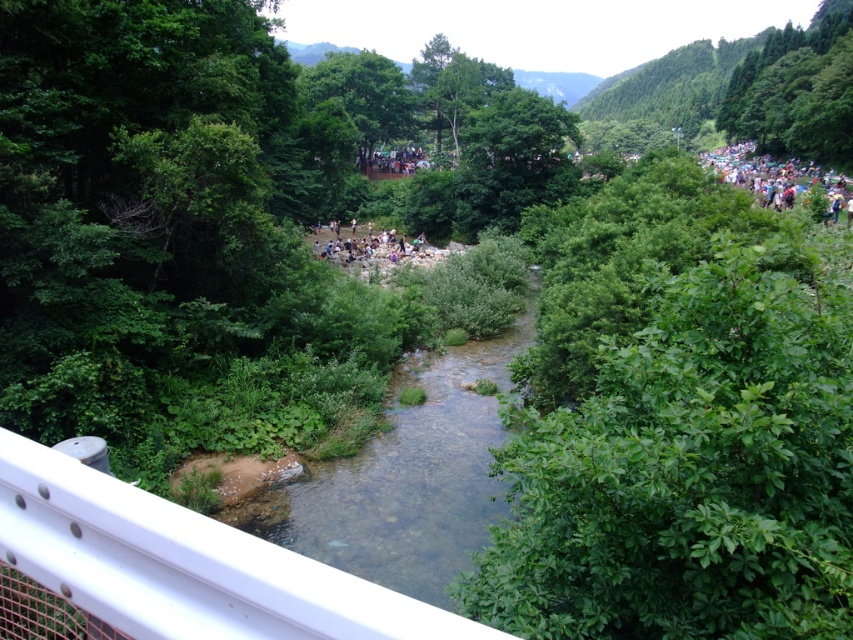
You are a photographer standing at the bottom left corner of the scene. You want to capture a photo that includes both the white metallic rail at lower left and the clear water at center. Which object should you adjust your camera angle to focus on first to ensure both are in frame?

The white metallic rail at lower left is shorter than the clear water at center, so you should adjust your camera angle to focus on the clear water at center first to ensure both are in frame.